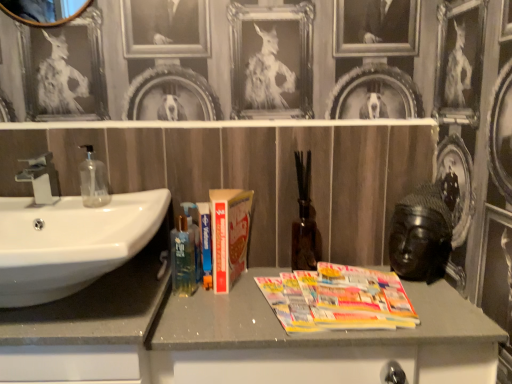
Question: Should I look upward or downward to see white glossy sink at left?

Choices:
 (A) up
 (B) down

Answer: (B)

Question: Is wooden mirror at upper left completely or partially outside of hardcover book at center?

Choices:
 (A) yes
 (B) no

Answer: (A)

Question: Is wooden mirror at upper left to the right of hardcover book at center from the viewer's perspective?

Choices:
 (A) yes
 (B) no

Answer: (B)

Question: Is the position of wooden mirror at upper left less distant than that of hardcover book at center?

Choices:
 (A) no
 (B) yes

Answer: (B)

Question: From the image's perspective, is wooden mirror at upper left under hardcover book at center?

Choices:
 (A) no
 (B) yes

Answer: (A)

Question: Can you confirm if wooden mirror at upper left is shorter than hardcover book at center?

Choices:
 (A) no
 (B) yes

Answer: (A)

Question: Considering the relative sizes of wooden mirror at upper left and hardcover book at center in the image provided, is wooden mirror at upper left bigger than hardcover book at center?

Choices:
 (A) yes
 (B) no

Answer: (B)

Question: From the image's perspective, is hardcover book at center beneath wooden mirror at upper left?

Choices:
 (A) no
 (B) yes

Answer: (B)

Question: Considering the relative sizes of hardcover book at center and wooden mirror at upper left in the image provided, is hardcover book at center bigger than wooden mirror at upper left?

Choices:
 (A) no
 (B) yes

Answer: (B)

Question: From a real-world perspective, is hardcover book at center positioned under wooden mirror at upper left based on gravity?

Choices:
 (A) yes
 (B) no

Answer: (A)

Question: Would you say hardcover book at center is outside wooden mirror at upper left?

Choices:
 (A) yes
 (B) no

Answer: (A)

Question: Would you say hardcover book at center is a long distance from wooden mirror at upper left?

Choices:
 (A) no
 (B) yes

Answer: (A)

Question: Can you confirm if hardcover book at center is positioned to the right of wooden mirror at upper left?

Choices:
 (A) no
 (B) yes

Answer: (B)

Question: Is wooden mirror at upper left wider than transparent glass soap dispenser at left?

Choices:
 (A) no
 (B) yes

Answer: (A)